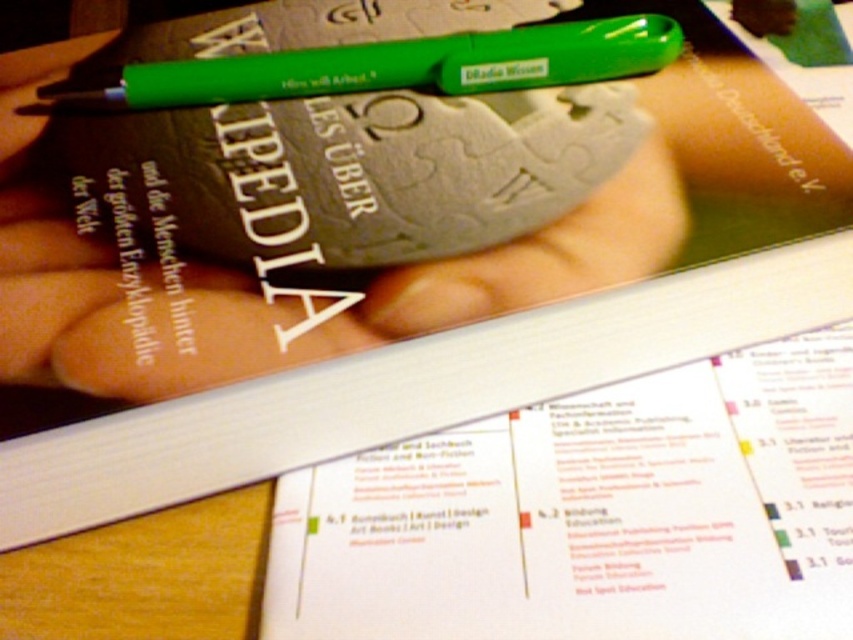
You are organizing a desk and see the green matte pen at upper center and the green plastic pen at upper center. Which pen is positioned to the left side?

The green matte pen at upper center is positioned to the left of the green plastic pen at upper center.

Looking at this image, you are organizing a stationery set and need to place both the green matte pen at upper center and the green plastic pen at upper center into a vertical pen holder. Which pen should you place first to ensure both fit properly?

The green matte pen at upper center is much taller than the green plastic pen at upper center, so you should place the green matte pen at upper center first to accommodate its height before adding the shorter green plastic pen at upper center.

You are organizing a stationery set and need to place both the green matte pen at upper center and the green plastic pen at upper center into a small compartment. The compartment can only fit one pen at a time. Which pen should you choose to ensure it fits?

The green plastic pen at upper center should be chosen because it is smaller than the green matte pen at upper center, making it more likely to fit in the small compartment.